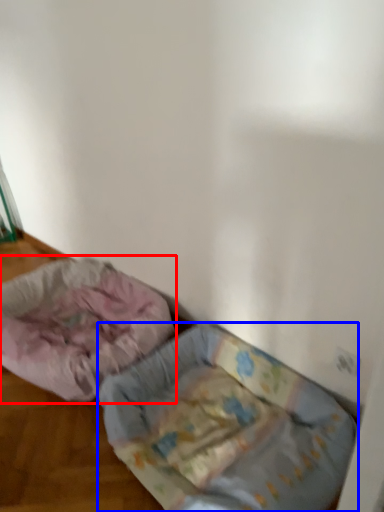
Question: Which of the following is the farthest to the observer, dog bed (highlighted by a red box) or dog bed (highlighted by a blue box)?

Choices:
 (A) dog bed
 (B) dog bed

Answer: (A)